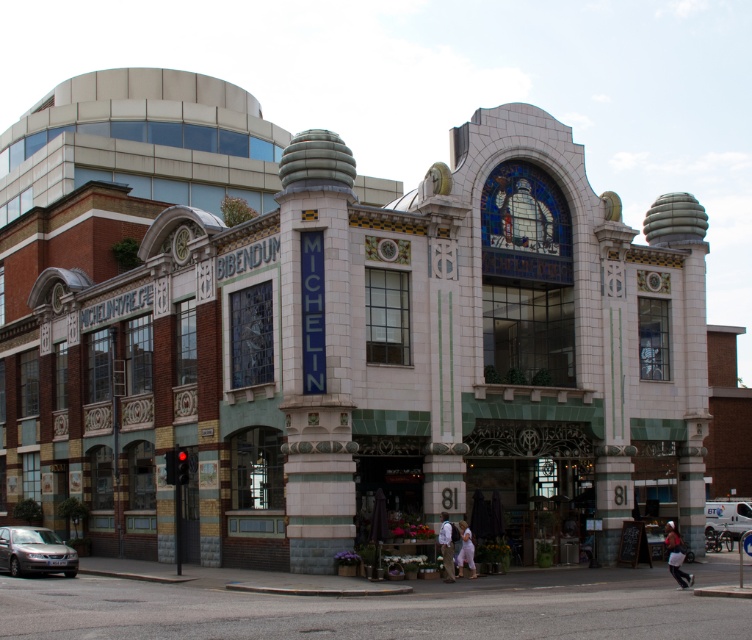
You are a photographer standing in front of the white tile department store at center and the silver metallic car at lower left. You want to capture a photo that includes both objects in the frame. Considering their sizes, which object should you position closer to the camera to ensure both are visible in the frame?

The white tile department store at center is much taller than the silver metallic car at lower left. To include both in the frame, position the silver metallic car at lower left closer to the camera so that its size appears more balanced with the taller department store.

You are a photographer standing in front of the building. You want to take a photo that includes both the white tile department store at center and the silver metallic car at lower left. Which object should you focus on first to ensure both are in frame?

The white tile department store at center is bigger than the silver metallic car at lower left, so you should focus on the white tile department store at center first to ensure it fits in the frame, allowing space for the smaller silver metallic car at lower left.